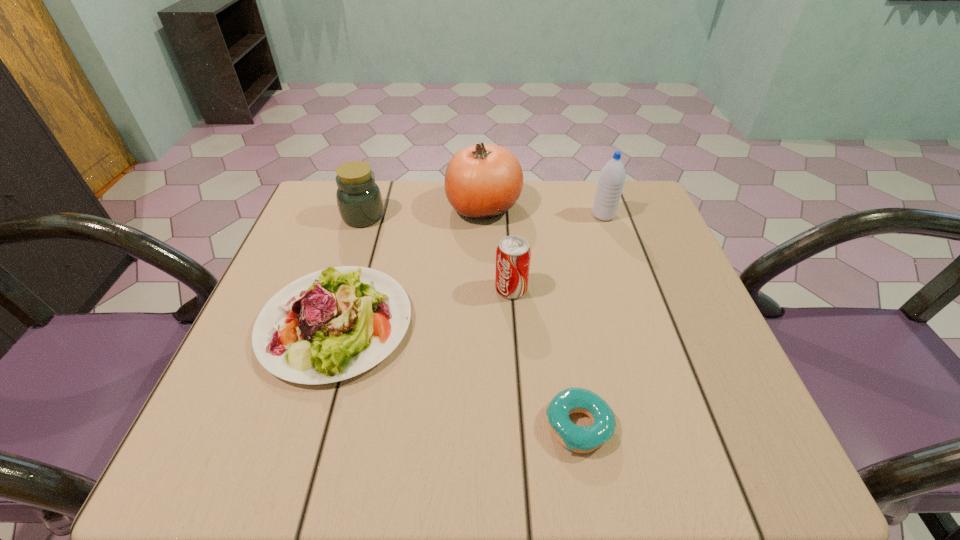
The image size is (960, 540). Identify the location of object that is positioned at the far left corner. (359, 200).

The image size is (960, 540). I want to click on object that is at the far right corner, so click(611, 180).

I want to click on free space at the far edge of the desktop, so click(x=554, y=231).

This screenshot has height=540, width=960. Identify the location of vacant space at the near edge of the desktop. (509, 469).

What are the coordinates of `vacant area at the left edge of the desktop` in the screenshot? It's located at (275, 418).

The width and height of the screenshot is (960, 540). I want to click on free space at the right edge of the desktop, so click(645, 248).

The width and height of the screenshot is (960, 540). In order to click on free space at the near left corner of the desktop in this screenshot , I will do `click(237, 426)`.

I want to click on free point at the far right corner, so click(658, 218).

Locate an element on the screen. This screenshot has height=540, width=960. free spot between the salad plate and the doughnut is located at coordinates (457, 375).

This screenshot has height=540, width=960. Find the location of `free space between the soda can and the doughnut`. free space between the soda can and the doughnut is located at coordinates (545, 357).